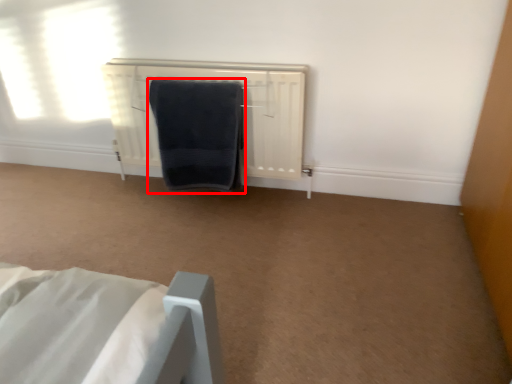
Question: From the image's perspective, where is towel (annotated by the red box) located in relation to radiator in the image?

Choices:
 (A) below
 (B) above

Answer: (A)